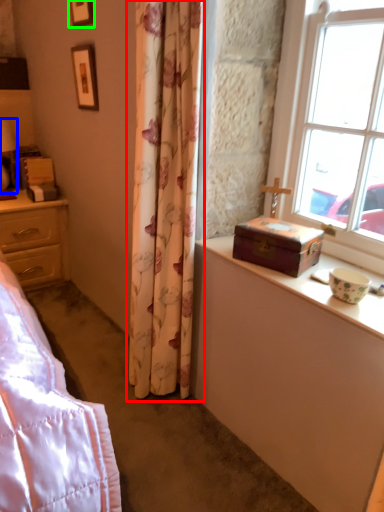
Question: Based on their relative distances, which object is farther from curtain (highlighted by a red box)? Choose from table lamp (highlighted by a blue box) and picture frame (highlighted by a green box).

Choices:
 (A) table lamp
 (B) picture frame

Answer: (A)